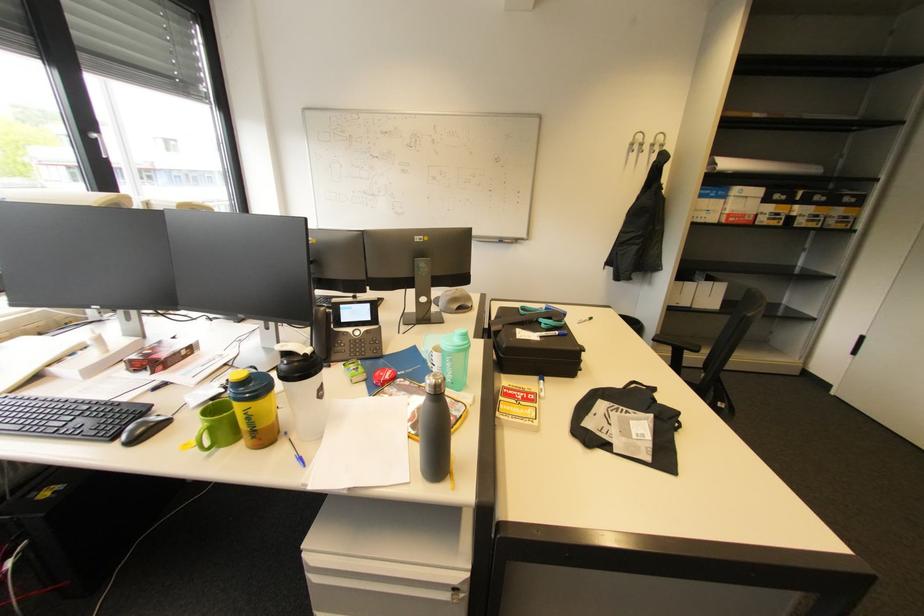
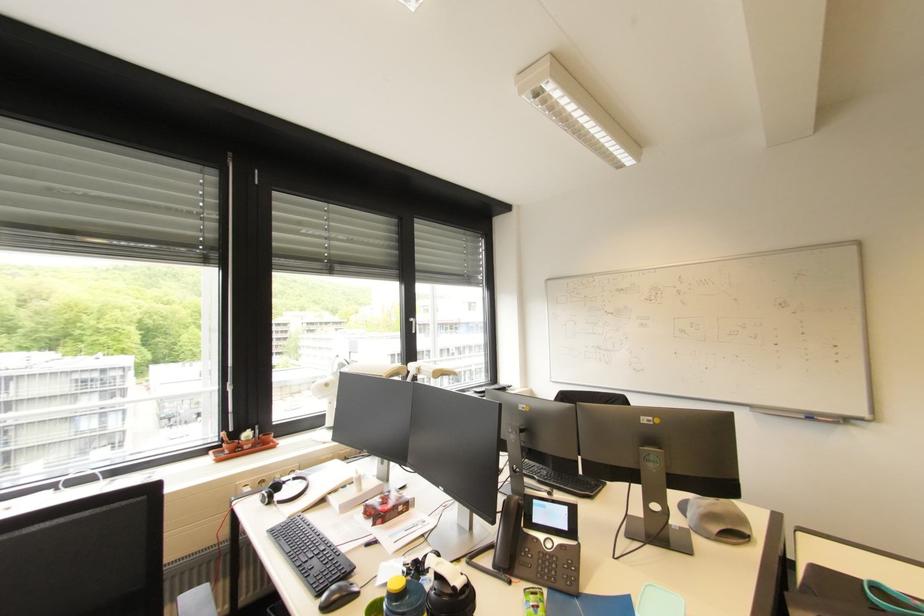
Locate, in the second image, the point that corresponds to [140,442] in the first image.

(332, 609)